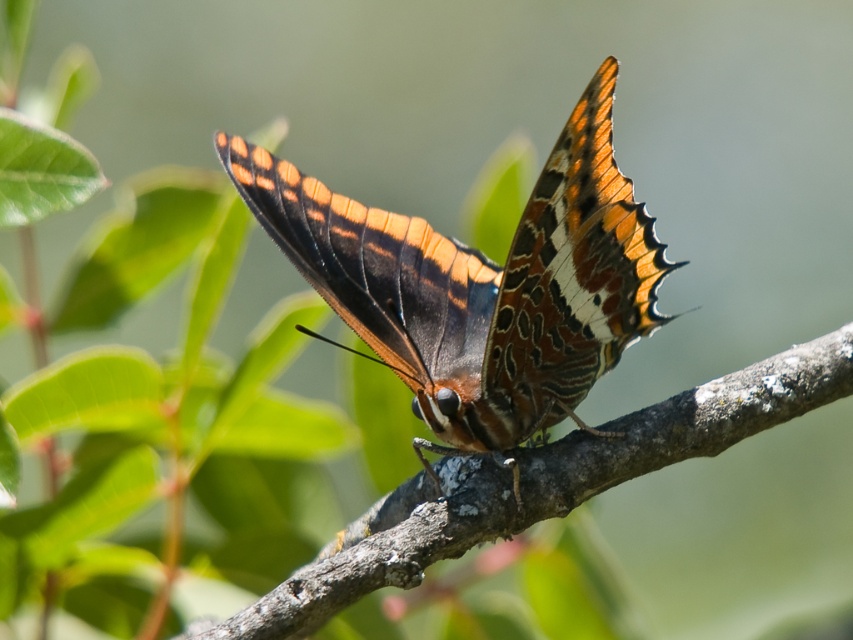
You are observing a butterfly on a branch and notice two points marked on its wings. The first point is at coordinates point (525, 436), and the second point is at point (762, 420). Which of these points is nearer to your eyes?

Point (525, 436) is closer to the viewer than point (762, 420).

You are an entomologist observing the scene. You need to determine the relative positions of the shiny orange butterfly at center and the brown rough tree branch at center. Which object is above the other?

The shiny orange butterfly at center is positioned over brown rough tree branch at center, so the butterfly is above the branch.

You are an entomologist examining a butterfly specimen. You notice a point at coordinates (480, 285) on your digital image. What does this point indicate?

The point at coordinates (480, 285) marks the location of the shiny orange butterfly at center in the image.